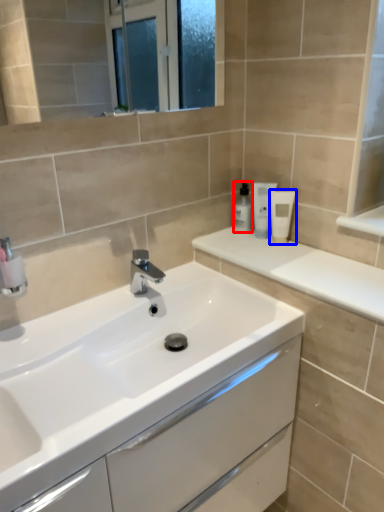
Question: Which of the following is the farthest to the observer, toiletry (highlighted by a red box) or toiletry (highlighted by a blue box)?

Choices:
 (A) toiletry
 (B) toiletry

Answer: (A)